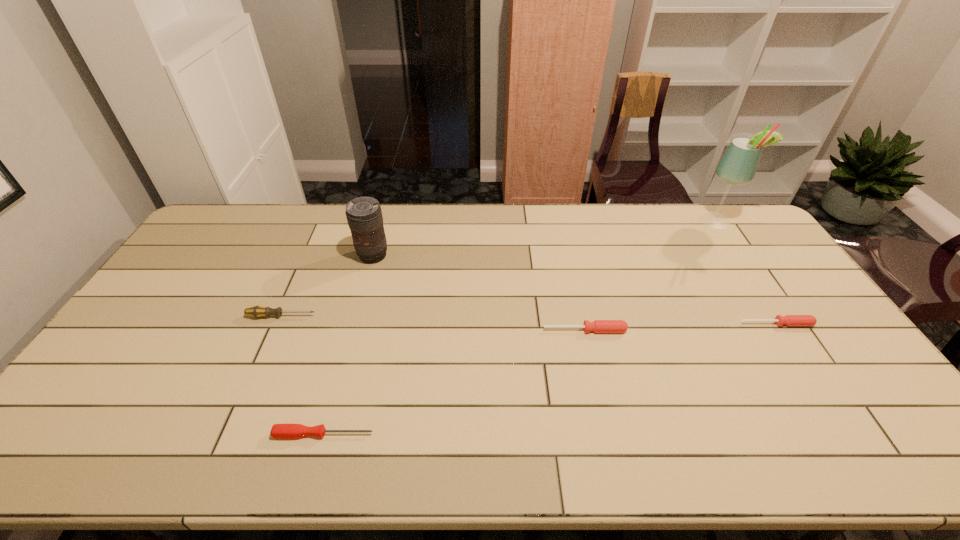
Where is `vacant position in the image that satisfies the following two spatial constraints: 1. at the tip of the leftmost screwdriver; 2. on the right side of the rightmost screwdriver`? Image resolution: width=960 pixels, height=540 pixels. vacant position in the image that satisfies the following two spatial constraints: 1. at the tip of the leftmost screwdriver; 2. on the right side of the rightmost screwdriver is located at coordinates (277, 324).

This screenshot has width=960, height=540. What are the coordinates of `free space that satisfies the following two spatial constraints: 1. on the front side of the third screwdriver from left to right; 2. at the tip of the third screwdriver from right to left` in the screenshot? It's located at (609, 434).